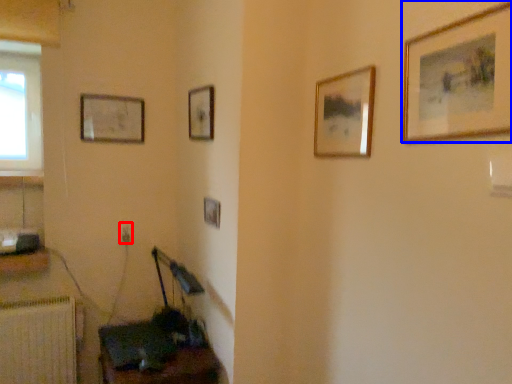
Question: Which of the following is the farthest to the observer, electric outlet (highlighted by a red box) or picture frame (highlighted by a blue box)?

Choices:
 (A) electric outlet
 (B) picture frame

Answer: (A)